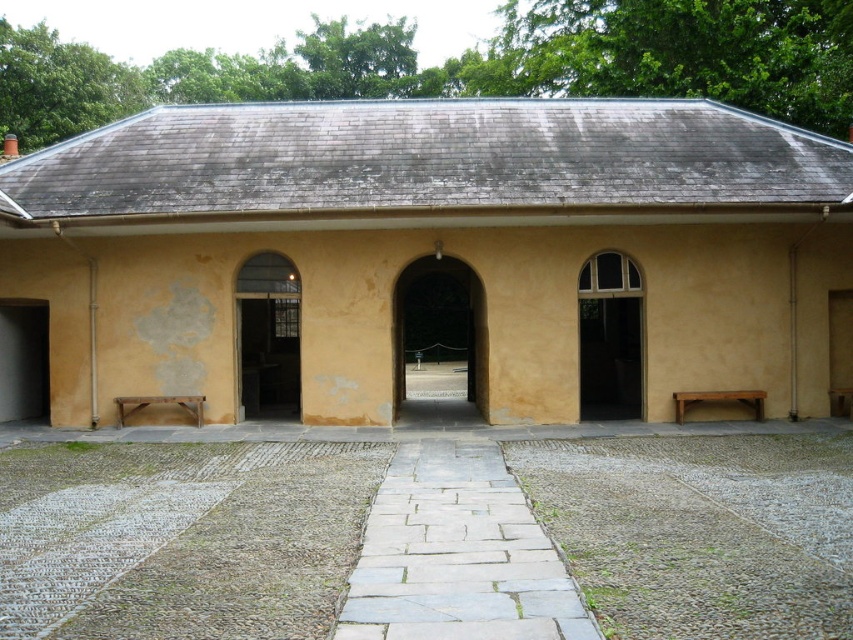
Question: Which point is farther from the camera taking this photo?

Choices:
 (A) (457, 353)
 (B) (614, 332)

Answer: (A)

Question: Does smooth stone archway at center have a greater width compared to matte glass door at center?

Choices:
 (A) no
 (B) yes

Answer: (B)

Question: Which of the following is the farthest from the observer?

Choices:
 (A) smooth stone archway at center
 (B) matte glass door at center

Answer: (A)

Question: Considering the relative positions of clear glass door at center and matte glass door at center in the image provided, where is clear glass door at center located with respect to matte glass door at center?

Choices:
 (A) below
 (B) above

Answer: (B)

Question: Observing the image, what is the correct spatial positioning of clear glass door at center in reference to smooth stone archway at center?

Choices:
 (A) left
 (B) right

Answer: (B)

Question: Which point is farther to the camera?

Choices:
 (A) clear glass door at center
 (B) matte glass door at center
 (C) smooth stone archway at center

Answer: (A)